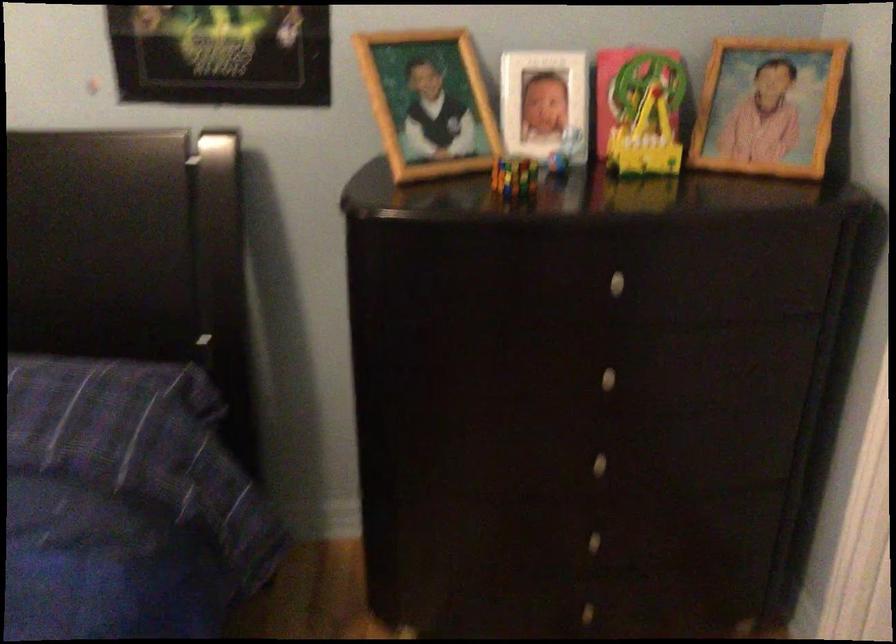
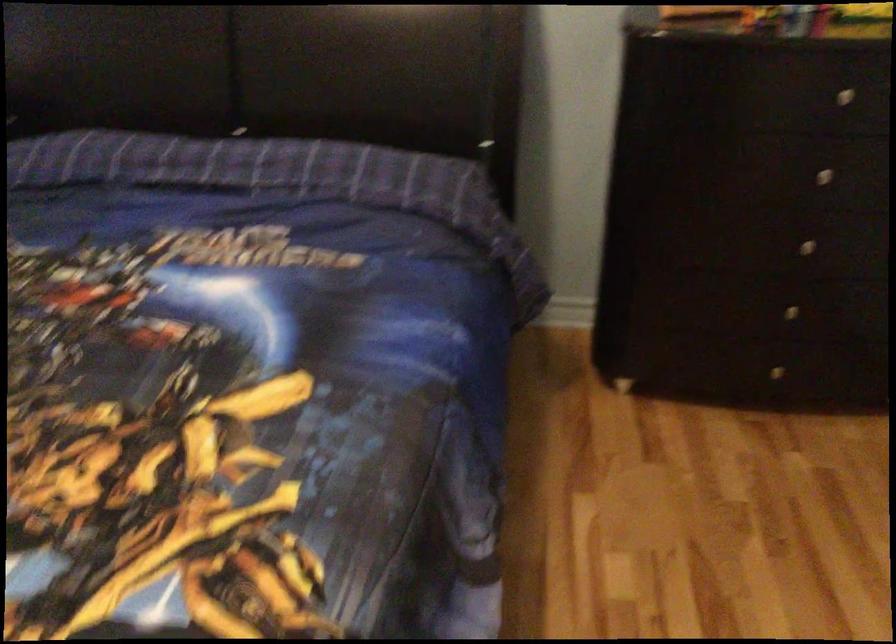
The point at (635, 275) is marked in the first image. Where is the corresponding point in the second image?

(858, 91)